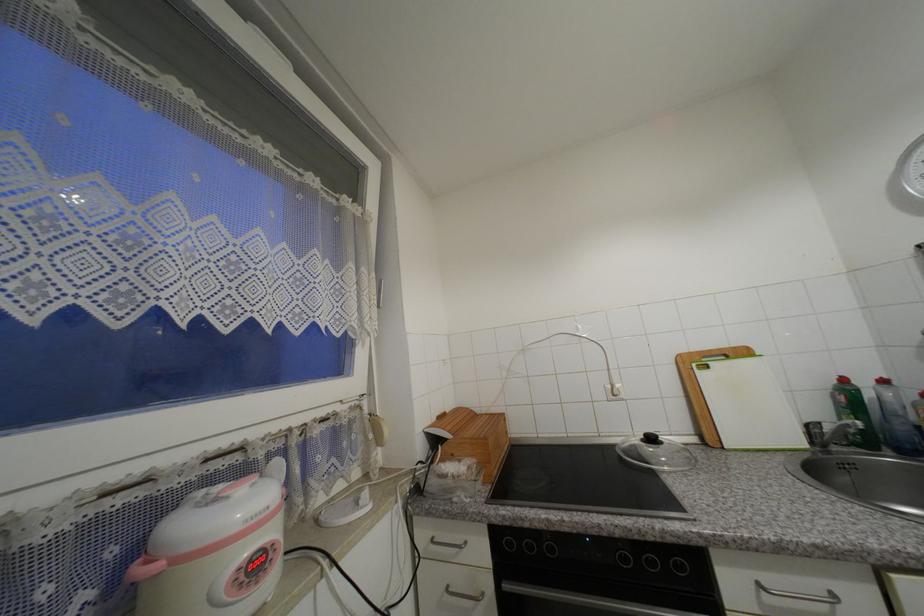
Where would you turn the sink faucet handle? Please return your answer as a coordinate pair (x, y).

(831, 432)